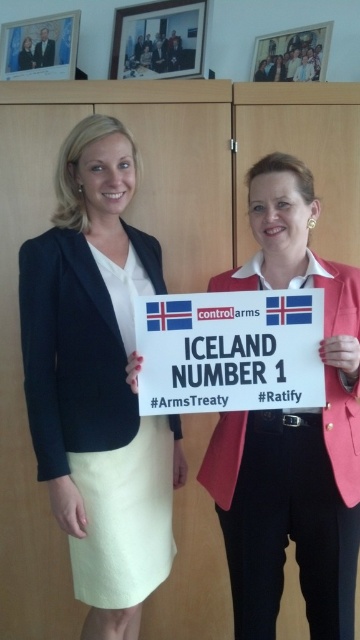
Does matte black blazer at center lie in front of white paper sign at center?

No, it is not.

Which is above, matte black blazer at center or white paper sign at center?

white paper sign at center

Between point (29, 413) and point (263, 339), which one is positioned behind?

Positioned behind is point (29, 413).

At what (x,y) coordinates should I click in order to perform the action: click on matte black blazer at center. Please return your answer as a coordinate pair (x, y). Image resolution: width=360 pixels, height=640 pixels. Looking at the image, I should click on (97, 381).